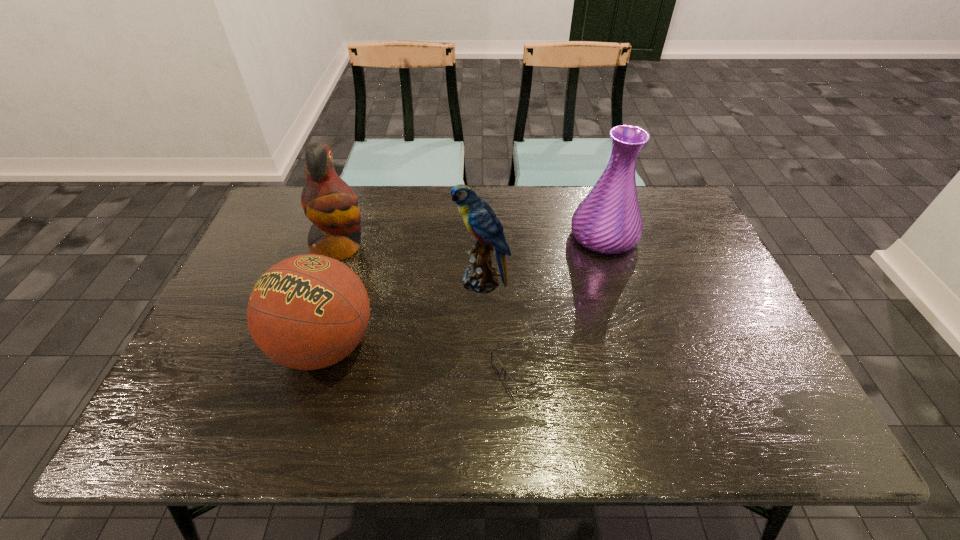
The image size is (960, 540). What are the coordinates of `vacant space in between the second shortest object and the spectacles` in the screenshot? It's located at (421, 359).

At what (x,y) coordinates should I click in order to perform the action: click on vacant space in between the basketball and the shorter parrot. Please return your answer as a coordinate pair (x, y). This screenshot has width=960, height=540. Looking at the image, I should click on (403, 313).

At what (x,y) coordinates should I click in order to perform the action: click on object that is the fourth closest to the vase. Please return your answer as a coordinate pair (x, y). This screenshot has height=540, width=960. Looking at the image, I should click on (328, 202).

Where is `the second closest object to the farther parrot`? This screenshot has width=960, height=540. the second closest object to the farther parrot is located at coordinates (480, 219).

Locate an element on the screen. This screenshot has width=960, height=540. vacant space that satisfies the following two spatial constraints: 1. on the back side of the rightmost object; 2. on the left side of the second shortest object is located at coordinates (357, 237).

In order to click on vacant space that satisfies the following two spatial constraints: 1. on the front side of the rightmost object; 2. on the face of the left parrot in this screenshot , I will do `click(607, 248)`.

Where is `vacant area in the image that satisfies the following two spatial constraints: 1. on the face of the left parrot; 2. on the right side of the basketball`? vacant area in the image that satisfies the following two spatial constraints: 1. on the face of the left parrot; 2. on the right side of the basketball is located at coordinates (307, 346).

Identify the location of vacant area that satisfies the following two spatial constraints: 1. on the front side of the vase; 2. on the face of the farther parrot. (607, 248).